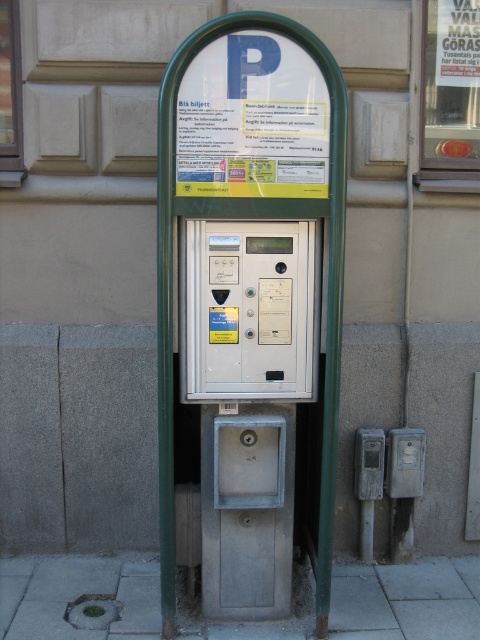
Question: Among these points, which one is nearest to the camera?

Choices:
 (A) (28, 632)
 (B) (277, 364)

Answer: (B)

Question: Can you confirm if gray concrete pavement at lower left is wider than white plastic parking meter at center?

Choices:
 (A) no
 (B) yes

Answer: (B)

Question: Does metallic gray parking meter at center have a smaller size compared to white plastic parking meter at center?

Choices:
 (A) no
 (B) yes

Answer: (A)

Question: Can you confirm if metallic gray parking meter at center is wider than gray concrete pavement at lower left?

Choices:
 (A) yes
 (B) no

Answer: (B)

Question: Which point is farther from the camera taking this photo?

Choices:
 (A) (310, 296)
 (B) (332, 612)
 (C) (194, 392)

Answer: (B)

Question: Which point is closer to the camera taking this photo?

Choices:
 (A) (169, 632)
 (B) (267, 321)
 (C) (310, 628)

Answer: (B)